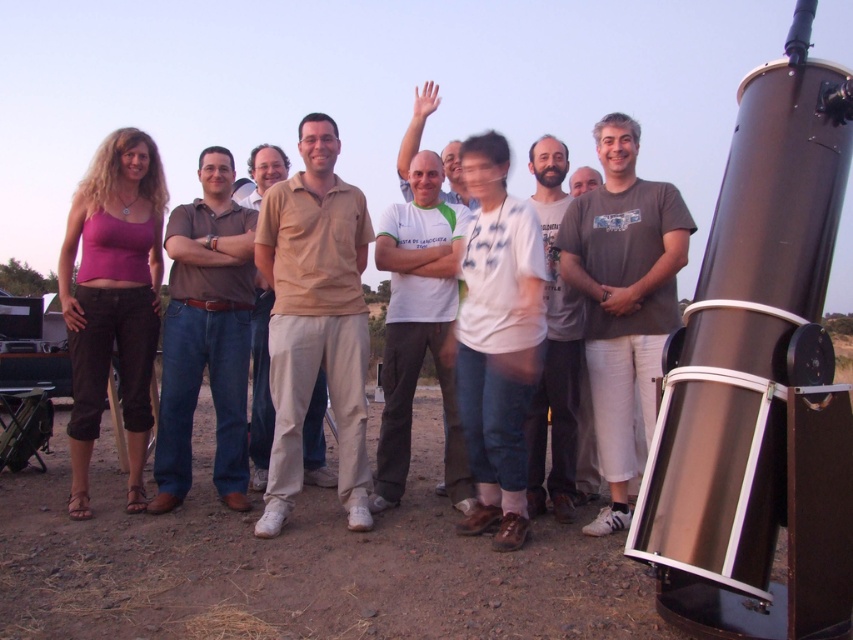
Does beige cotton polo shirt at center have a lesser width compared to white cotton t-shirt at center?

No.

Between beige cotton polo shirt at center and white cotton t-shirt at center, which one is positioned higher?

Positioned higher is beige cotton polo shirt at center.

You are a GUI agent. You are given a task and a screenshot of the screen. Output one action in this format:
    pyautogui.click(x=<x>, y=<y>)
    Task: Click on the beige cotton polo shirt at center
    Image resolution: width=853 pixels, height=640 pixels.
    Given the screenshot: What is the action you would take?
    pyautogui.click(x=315, y=320)

Measure the distance between gray cotton t-shirt at center and brown denim jeans at center.

gray cotton t-shirt at center is 2.23 meters away from brown denim jeans at center.

Is gray cotton t-shirt at center bigger than brown denim jeans at center?

Correct, gray cotton t-shirt at center is larger in size than brown denim jeans at center.

Does point (624, 237) lie behind point (225, 356)?

No.

Identify the location of gray cotton t-shirt at center. (624, 298).

This screenshot has width=853, height=640. Find the location of `beige cotton polo shirt at center`. beige cotton polo shirt at center is located at coordinates (315, 320).

Is beige cotton polo shirt at center further to camera compared to gray cotton t-shirt at center?

Yes, it is behind gray cotton t-shirt at center.

Where is `beige cotton polo shirt at center`? The height and width of the screenshot is (640, 853). beige cotton polo shirt at center is located at coordinates (315, 320).